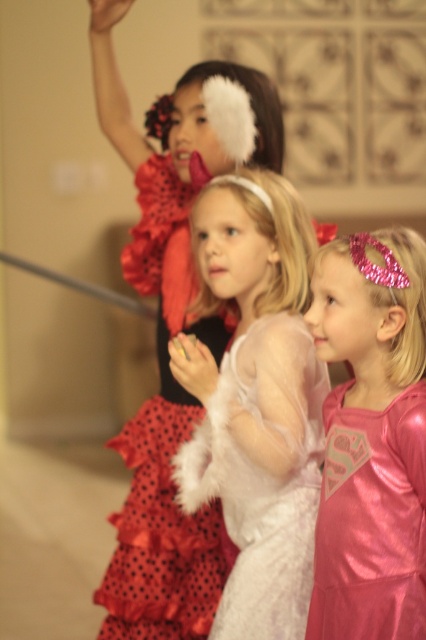
Is white fluffy dress at center below matte black dress at upper left?

Yes, white fluffy dress at center is below matte black dress at upper left.

Does point (204, 380) come farther from viewer compared to point (175, 154)?

No, (204, 380) is closer to viewer.

Image resolution: width=426 pixels, height=640 pixels. What are the coordinates of `white fluffy dress at center` in the screenshot? It's located at (256, 401).

Based on the photo, can you confirm if pink shiny dress at center is positioned above red polka dot fabric ballet skirt at center?

Yes, pink shiny dress at center is above red polka dot fabric ballet skirt at center.

Locate an element on the screen. The height and width of the screenshot is (640, 426). pink shiny dress at center is located at coordinates (371, 438).

Is matte black dress at upper left to the left of pink shiny dress at center from the viewer's perspective?

Correct, you'll find matte black dress at upper left to the left of pink shiny dress at center.

Between matte black dress at upper left and pink shiny dress at center, which one appears on the right side from the viewer's perspective?

From the viewer's perspective, pink shiny dress at center appears more on the right side.

Which is behind, point (120, 584) or point (379, 451)?

The point (120, 584) is more distant.

Where is `matte black dress at upper left`? Image resolution: width=426 pixels, height=640 pixels. matte black dress at upper left is located at coordinates (166, 346).